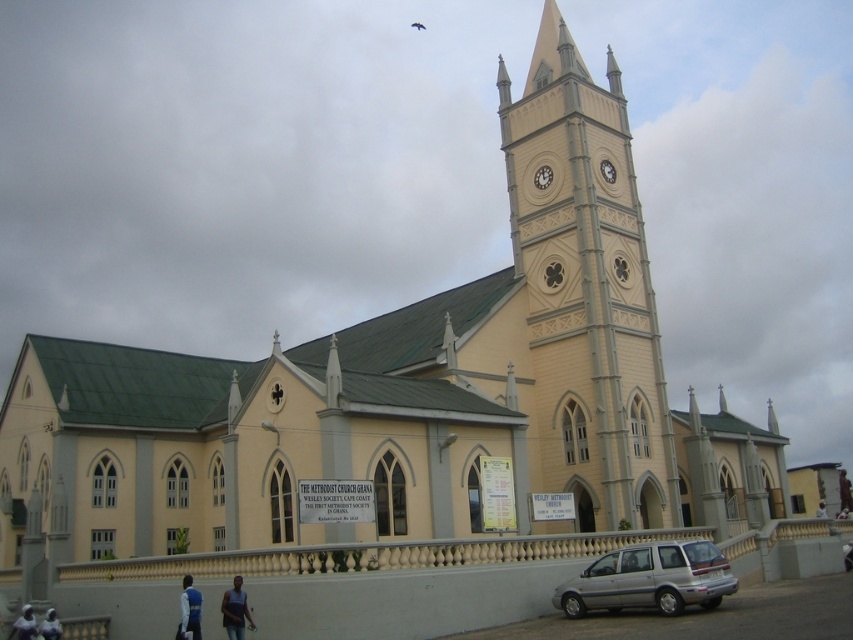
Which is below, dark skin textured shirt at lower center or blue fabric jacket at lower left?

blue fabric jacket at lower left is lower down.

Is dark skin textured shirt at lower center to the right of blue fabric jacket at lower left from the viewer's perspective?

Indeed, dark skin textured shirt at lower center is positioned on the right side of blue fabric jacket at lower left.

Is point (227, 625) more distant than point (184, 589)?

No, it is in front of (184, 589).

I want to click on dark skin textured shirt at lower center, so click(235, 611).

Can you confirm if blue fabric jacket at lower left is bigger than dark blue fabric person at lower left?

Yes.

Does blue fabric jacket at lower left appear on the left side of dark blue fabric person at lower left?

No, blue fabric jacket at lower left is not to the left of dark blue fabric person at lower left.

Is point (184, 624) closer to camera compared to point (45, 616)?

That is True.

Find the location of `blue fabric jacket at lower left`. blue fabric jacket at lower left is located at coordinates (189, 611).

The height and width of the screenshot is (640, 853). I want to click on yellow wood clock tower at center, so click(585, 289).

Does point (585, 468) lie behind point (21, 636)?

Yes.

Measure the distance between point (625, 340) and camera.

A distance of 222.29 feet exists between point (625, 340) and camera.

Image resolution: width=853 pixels, height=640 pixels. Identify the location of yellow wood clock tower at center. (585, 289).